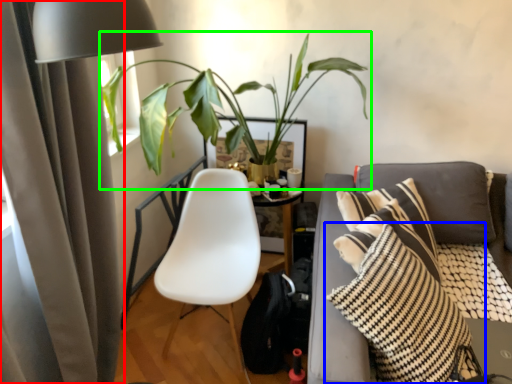
Question: Which object is the closest to the curtain (highlighted by a red box)? Choose among these: pillow (highlighted by a blue box) or houseplant (highlighted by a green box).

Choices:
 (A) pillow
 (B) houseplant

Answer: (B)